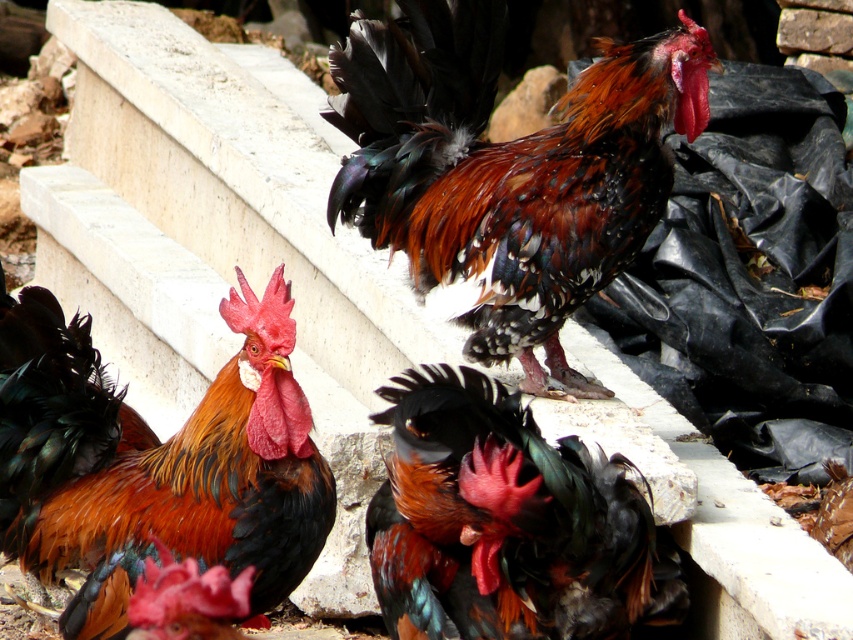
You are standing in a rustic outdoor area and see a shiny multicolored rooster at center. If you want to take a photo of it with your phone camera, which has a minimum focus distance of 1 meter, will you be able to take a clear photo without moving closer?

The shiny multicolored rooster at center and camera are 3.41 meters apart. Since the minimum focus distance is 1 meter, you can take a clear photo without moving closer because the distance is sufficient.

You are observing two sets of feathers on a rooster in the image. The shiny orange feathers at center and the shiny black feathers at center. Which set of feathers is located to the left?

The shiny orange feathers at center is positioned on the left side of shiny black feathers at center.

You are a farmer who wants to place a 36 inch wide fence panel between the shiny multicolored rooster at center and the shiny black feathers at center. Can the fence panel fit between them without overlapping either object?

The distance between the shiny multicolored rooster at center and the shiny black feathers at center is 34.21 inches. Since the fence panel is 36 inches wide, it is slightly wider than the space available. Therefore, the fence panel cannot fit between them without overlapping one or both objects.